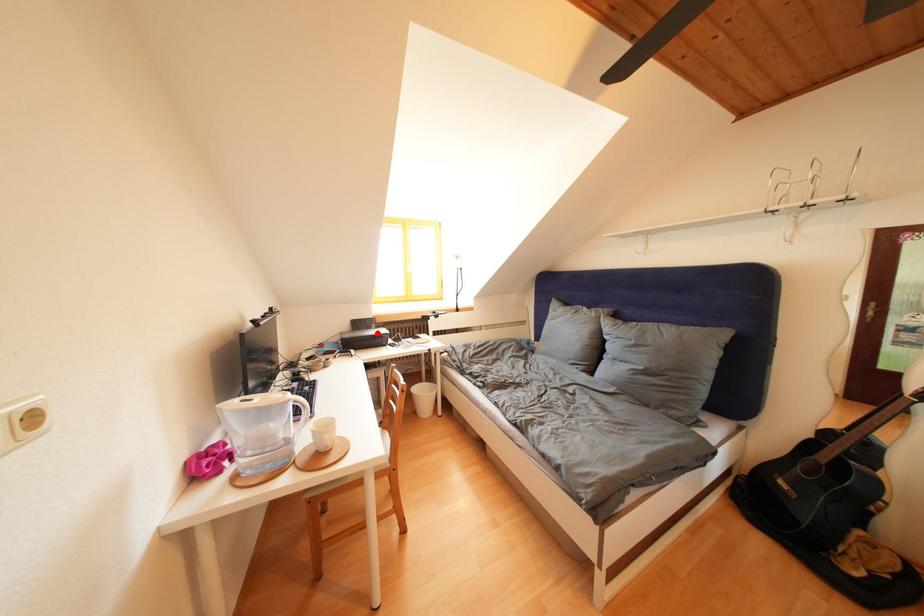
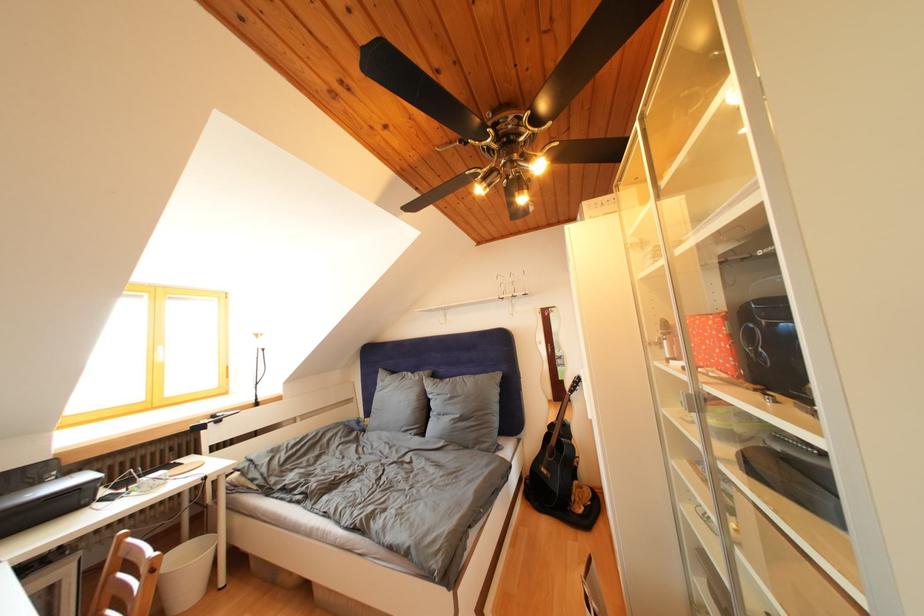
Locate, in the second image, the point that corresponds to the highlighted location in the first image.

(44, 488)